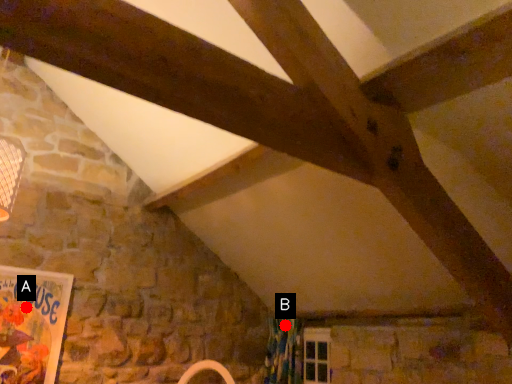
Question: Two points are circled on the image, labeled by A and B beside each circle. Which point is farther to the camera?

Choices:
 (A) A is further
 (B) B is further

Answer: (B)